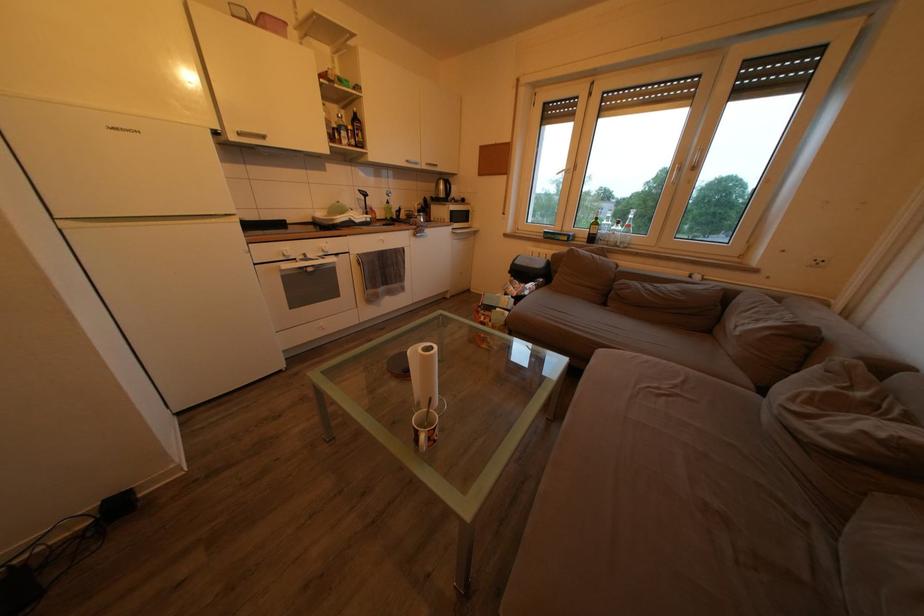
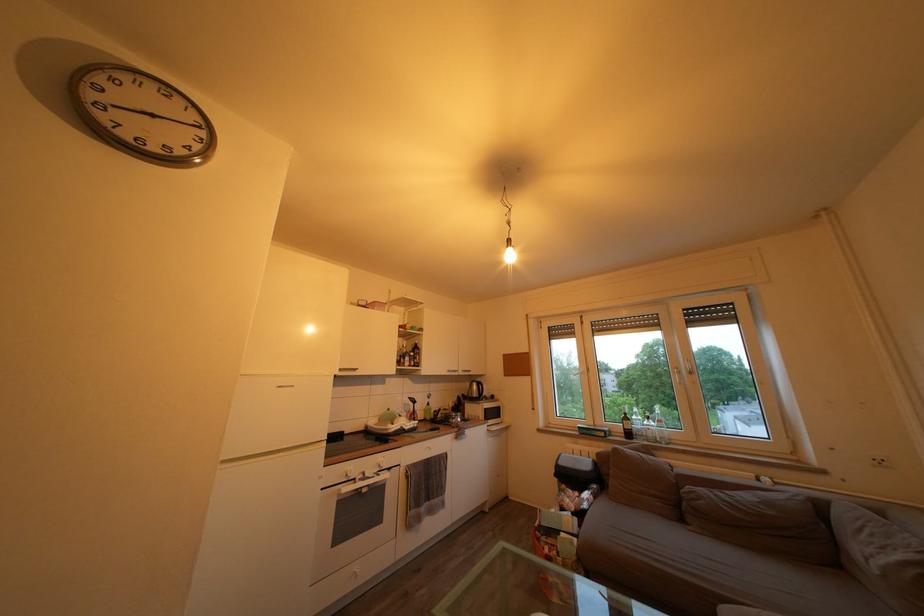
Locate, in the second image, the point that corresponds to pixel 603 230 in the first image.

(635, 424)